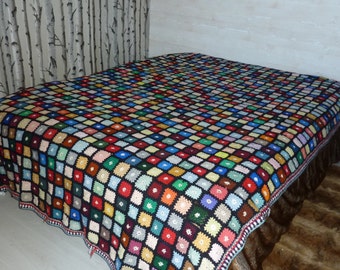
Locate an element on the screen. The height and width of the screenshot is (270, 340). left corner of bed is located at coordinates (4, 115).